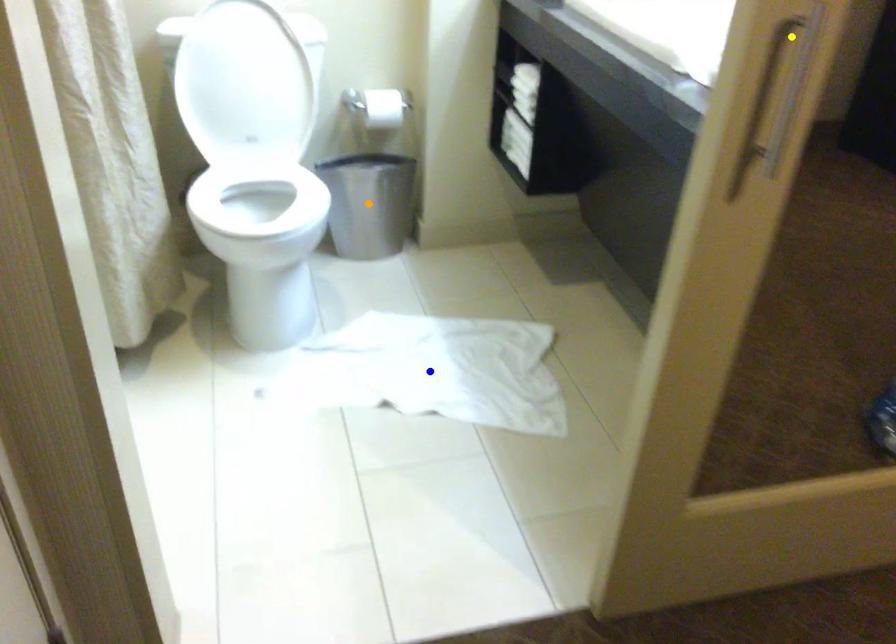
Order these from nearest to farthest:
1. orange point
2. yellow point
3. blue point

yellow point
blue point
orange point